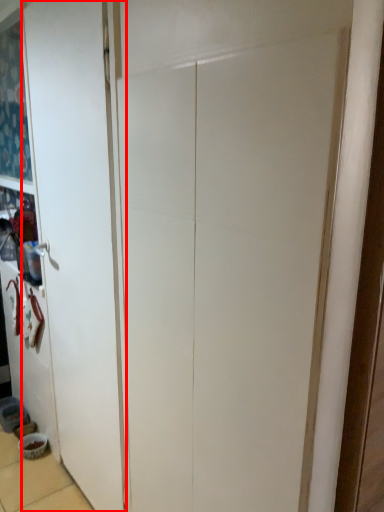
Question: From the image's perspective, what is the correct spatial relationship of door (annotated by the red box) in relation to bowl?

Choices:
 (A) above
 (B) below

Answer: (A)